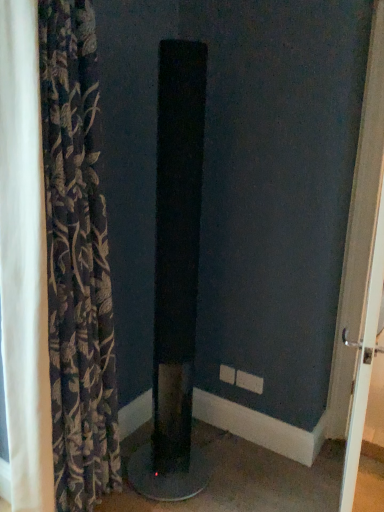
Question: From a real-world perspective, is black matte speaker at center physically located above or below dark floral fabric curtain at left?

Choices:
 (A) above
 (B) below

Answer: (B)

Question: Considering the positions of black matte speaker at center and dark floral fabric curtain at left in the image, is black matte speaker at center bigger or smaller than dark floral fabric curtain at left?

Choices:
 (A) big
 (B) small

Answer: (B)

Question: Which is farther from the dark floral fabric curtain at left?

Choices:
 (A) white glossy door handle at right
 (B) black matte speaker at center

Answer: (A)

Question: Estimate the real-world distances between objects in this image. Which object is closer to the dark floral fabric curtain at left?

Choices:
 (A) white glossy door handle at right
 (B) black matte speaker at center

Answer: (B)